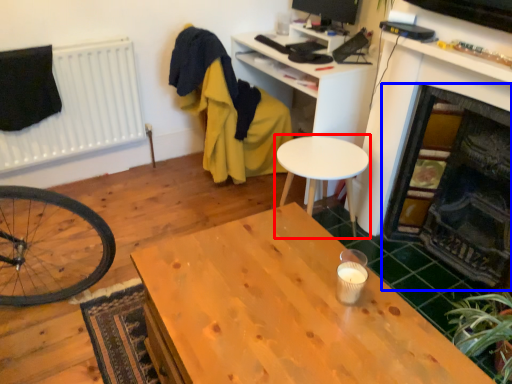
Question: Which object appears farthest to the camera in this image, table (highlighted by a red box) or fireplace (highlighted by a blue box)?

Choices:
 (A) table
 (B) fireplace

Answer: (A)